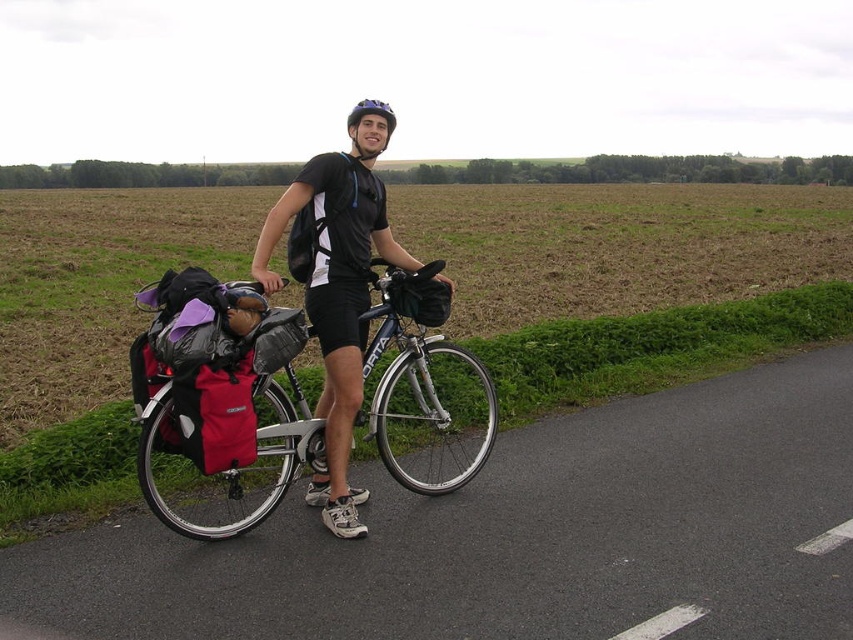
Is matte black bicycle at center bigger than purple matte bicycle helmet at center?

No.

Is matte black bicycle at center taller than purple matte bicycle helmet at center?

No, matte black bicycle at center is not taller than purple matte bicycle helmet at center.

Which is in front, point (306, 444) or point (350, 122)?

Point (306, 444)

Image resolution: width=853 pixels, height=640 pixels. In order to click on matte black bicycle at center in this screenshot , I will do `click(219, 420)`.

Who is positioned more to the right, black matte shirt at center or purple matte bicycle helmet at center?

Positioned to the right is black matte shirt at center.

Can you confirm if black matte shirt at center is thinner than purple matte bicycle helmet at center?

Yes, black matte shirt at center is thinner than purple matte bicycle helmet at center.

Who is more forward, (332, 460) or (381, 104)?

Point (332, 460) is more forward.

The height and width of the screenshot is (640, 853). Identify the location of black matte shirt at center. (335, 291).

Consider the image. Is matte black bicycle at center in front of black matte shirt at center?

No, it is not.

The image size is (853, 640). What are the coordinates of `matte black bicycle at center` in the screenshot? It's located at (219, 420).